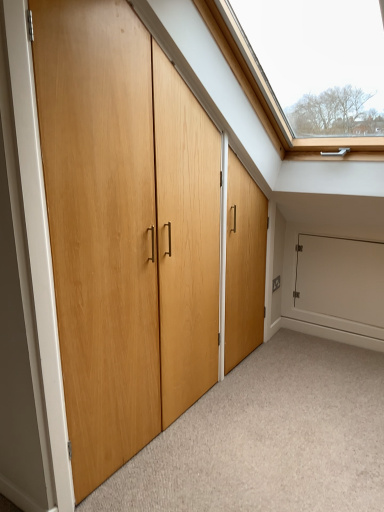
Where is `light wood door at center`? light wood door at center is located at coordinates (268, 438).

Image resolution: width=384 pixels, height=512 pixels. What do you see at coordinates (125, 229) in the screenshot? I see `natural wood door at center` at bounding box center [125, 229].

The image size is (384, 512). I want to click on natural wood door at center, so click(x=125, y=229).

What are the coordinates of `light wood door at center` in the screenshot? It's located at (268, 438).

Which of these two, natural wood door at center or light wood door at center, is wider?

With larger width is light wood door at center.

Considering the relative positions of natural wood door at center and light wood door at center in the image provided, is natural wood door at center to the left of light wood door at center from the viewer's perspective?

Yes.

Is natural wood door at center shorter than light wood door at center?

In fact, natural wood door at center may be taller than light wood door at center.

Based on their sizes in the image, would you say natural wood door at center is bigger or smaller than light wood door at center?

Clearly, natural wood door at center is larger in size than light wood door at center.

In the scene shown: Choose the correct answer: Is white matte cabinet at lower right inside light wood door at center or outside it?

white matte cabinet at lower right is not inside light wood door at center, it's outside.

Consider the image. What's the angular difference between white matte cabinet at lower right and light wood door at center's facing directions?

white matte cabinet at lower right and light wood door at center are facing 89.4 degrees away from each other.

Would you say white matte cabinet at lower right is to the left or to the right of light wood door at center in the picture?

Based on their positions, white matte cabinet at lower right is located to the right of light wood door at center.

Does point (320, 263) come farther from viewer compared to point (298, 390)?

That is True.

Does natural wood door at center come behind white matte cabinet at lower right?

Result: No, it is not.

From the picture: Considering the sizes of objects natural wood door at center and white matte cabinet at lower right in the image provided, who is smaller, natural wood door at center or white matte cabinet at lower right?

white matte cabinet at lower right.

Which of these two, natural wood door at center or white matte cabinet at lower right, stands shorter?

white matte cabinet at lower right.

Does light wood door at center have a lesser height compared to white matte cabinet at lower right?

Indeed, light wood door at center has a lesser height compared to white matte cabinet at lower right.

Between light wood door at center and white matte cabinet at lower right, which one has larger width?

light wood door at center.

At what (x,y) coordinates should I click in order to perform the action: click on plain beneath the white matte cabinet at lower right (from a real-world perspective). Please return your answer as a coordinate pair (x, y). This screenshot has width=384, height=512. Looking at the image, I should click on (268, 438).

From the image's perspective, does light wood door at center appear lower than white matte cabinet at lower right?

Yes, from the image's perspective, light wood door at center is below white matte cabinet at lower right.

Who is smaller, white matte cabinet at lower right or natural wood door at center?

Smaller between the two is white matte cabinet at lower right.

Which is farther from the camera, (x=297, y=259) or (x=62, y=365)?

The point (x=297, y=259) is behind.

Considering the positions of objects white matte cabinet at lower right and natural wood door at center in the image provided, who is more to the left, white matte cabinet at lower right or natural wood door at center?

natural wood door at center is more to the left.

Based on the photo, how far apart are white matte cabinet at lower right and natural wood door at center?

A distance of 4.98 feet exists between white matte cabinet at lower right and natural wood door at center.

Is light wood door at center taller or shorter than natural wood door at center?

Considering their sizes, light wood door at center has less height than natural wood door at center.

Is light wood door at center far from natural wood door at center?

No, light wood door at center is in close proximity to natural wood door at center.

Which of these two, light wood door at center or natural wood door at center, is thinner?

With smaller width is natural wood door at center.

Is point (150, 478) more distant than point (99, 406)?

Yes.

Locate an element on the screen. door behind the light wood door at center is located at coordinates (125, 229).

This screenshot has height=512, width=384. In order to click on garage door that is on the right side of light wood door at center in this screenshot , I will do `click(334, 283)`.

Considering their positions, is natural wood door at center positioned further to white matte cabinet at lower right than light wood door at center?

Based on the image, natural wood door at center appears to be further to white matte cabinet at lower right.

Based on their spatial positions, is light wood door at center or white matte cabinet at lower right further from natural wood door at center?

Based on the image, white matte cabinet at lower right appears to be further to natural wood door at center.

Estimate the real-world distances between objects in this image. Which object is further from light wood door at center, white matte cabinet at lower right or natural wood door at center?

The object further to light wood door at center is white matte cabinet at lower right.

From the image, which object appears to be farther from natural wood door at center, white matte cabinet at lower right or light wood door at center?

Among the two, white matte cabinet at lower right is located further to natural wood door at center.

From the image, which object appears to be nearer to white matte cabinet at lower right, light wood door at center or natural wood door at center?

Based on the image, light wood door at center appears to be nearer to white matte cabinet at lower right.

Considering their positions, is natural wood door at center positioned further to light wood door at center than white matte cabinet at lower right?

Based on the image, white matte cabinet at lower right appears to be further to light wood door at center.

Where is `door located between light wood door at center and white matte cabinet at lower right in the depth direction`? Image resolution: width=384 pixels, height=512 pixels. door located between light wood door at center and white matte cabinet at lower right in the depth direction is located at coordinates (125, 229).